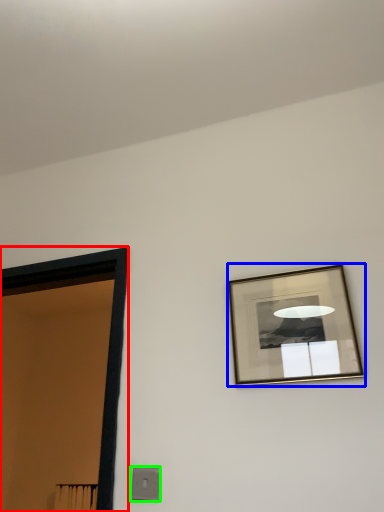
Question: Estimate the real-world distances between objects in this image. Which object is farther from door (highlighted by a red box), picture frame (highlighted by a blue box) or light switch (highlighted by a green box)?

Choices:
 (A) picture frame
 (B) light switch

Answer: (A)